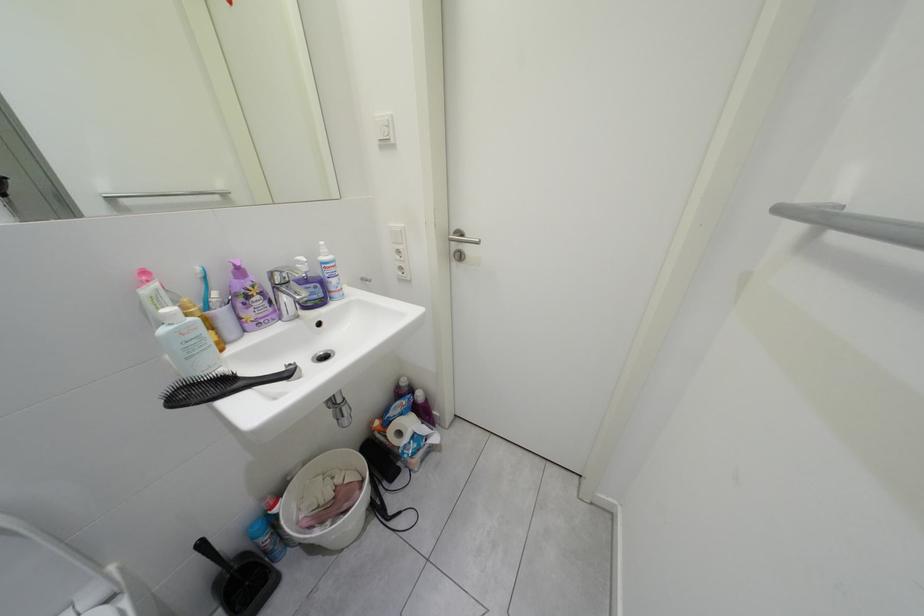
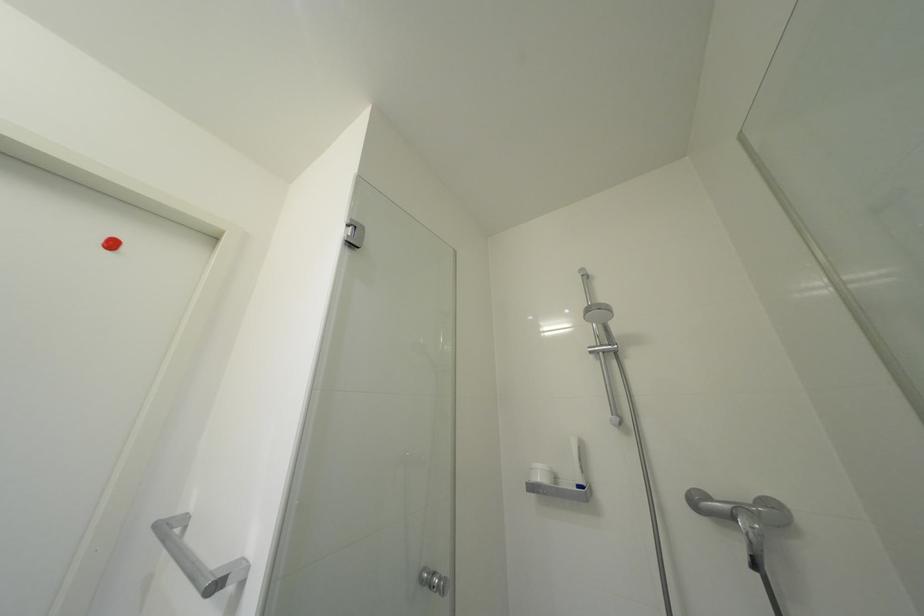
First-person continuous shooting, in which direction is the camera rotating?

The camera's rotation is toward right-up.